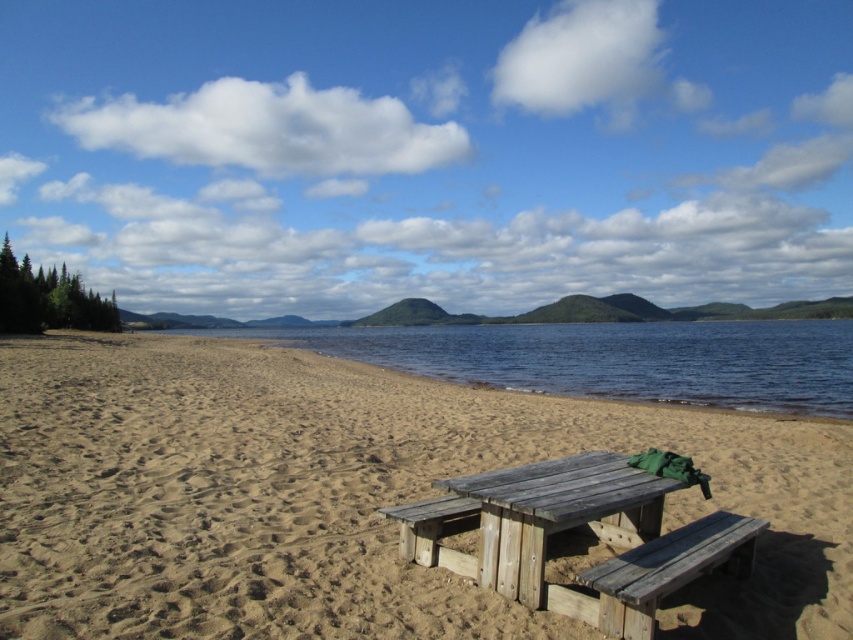
You are a photographer setting up equipment on the wooden park bench at lower right. You want to place your camera on the weathered wood picnic table at center to capture a wide shot. Is the distance between them sufficient to allow you to comfortably walk between them while carrying your camera?

The distance between the weathered wood picnic table at center and the wooden park bench at lower right is 19.81 inches. This distance is too narrow to comfortably walk between them while carrying equipment, as 19.81 inches is less than the typical space required for safe movement.

Based on the photo, you are standing on the brown sandy beach at center and want to reach the weathered wood picnic table at center. Which direction should you walk to get there?

You should walk to the right because the brown sandy beach at center is to the left of the weathered wood picnic table at center, so moving right from the beach will lead you towards the picnic table.